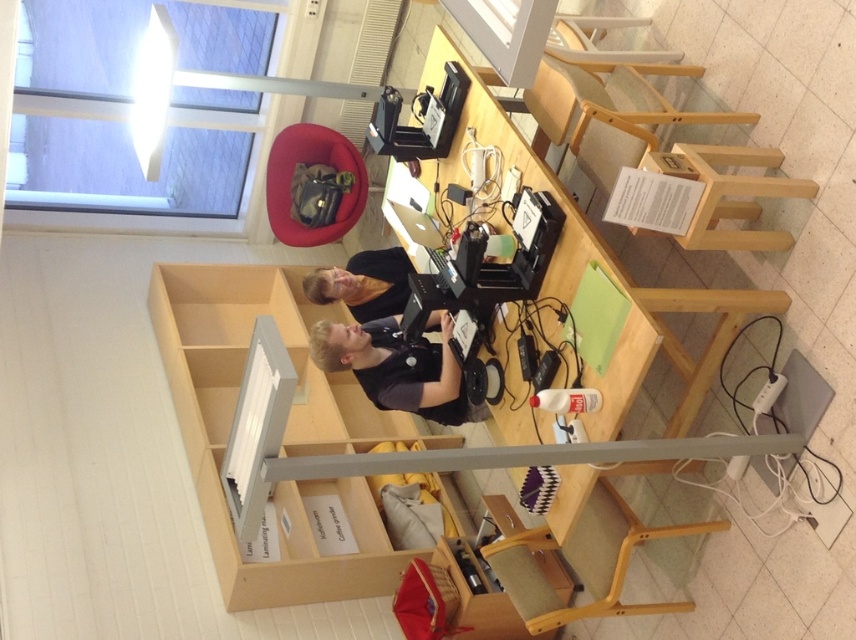
Question: Where is dark gray shirt at center located in relation to matte black shirt at center in the image?

Choices:
 (A) above
 (B) below

Answer: (B)

Question: Is dark gray shirt at center behind matte black shirt at center?

Choices:
 (A) no
 (B) yes

Answer: (A)

Question: Which point appears closest to the camera in this image?

Choices:
 (A) (461, 380)
 (B) (325, 280)

Answer: (A)

Question: Which of the following is the farthest from the observer?

Choices:
 (A) dark gray shirt at center
 (B) matte black shirt at center

Answer: (B)

Question: Does dark gray shirt at center have a larger size compared to matte black shirt at center?

Choices:
 (A) yes
 (B) no

Answer: (A)